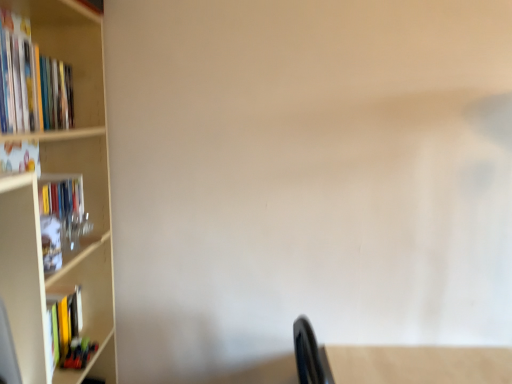
Question: Looking at the image, does white matte bookcase at left seem bigger or smaller compared to hardcover book at left, which is the second book from bottom to top?

Choices:
 (A) big
 (B) small

Answer: (A)

Question: From a real-world perspective, is white matte bookcase at left physically located above or below hardcover book at left, which is the second book from top to bottom?

Choices:
 (A) below
 (B) above

Answer: (A)

Question: Estimate the real-world distances between objects in this image. Which object is farther from the white matte bookcase at left?

Choices:
 (A) matte green book at lower left, arranged as the third book when viewed from the top
 (B) hardcover books at left, which is counted as the third book, starting from the bottom
 (C) hardcover book at left, which is the second book from bottom to top

Answer: (A)

Question: Estimate the real-world distances between objects in this image. Which object is closer to the matte green book at lower left, arranged as the third book when viewed from the top?

Choices:
 (A) white matte bookcase at left
 (B) hardcover books at left, which is counted as the third book, starting from the bottom
 (C) hardcover book at left, which is the second book from top to bottom

Answer: (A)